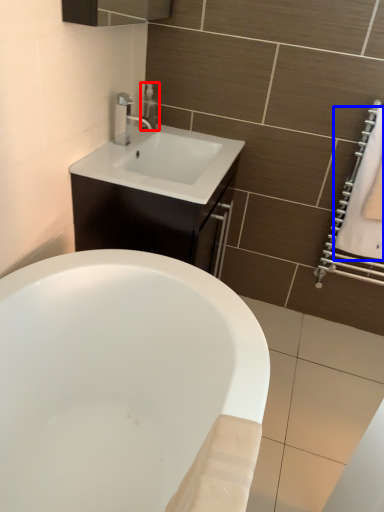
Question: Which point is further to the camera, soap dispenser (highlighted by a red box) or bath towel (highlighted by a blue box)?

Choices:
 (A) soap dispenser
 (B) bath towel

Answer: (A)